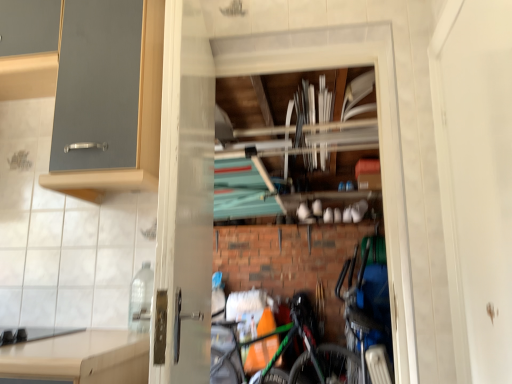
What do you see at coordinates (284, 352) in the screenshot? I see `green matte bicycle at center, positioned as the 1th bicycle in front-to-back order` at bounding box center [284, 352].

What is the approximate width of clear plastic bottle at lower left?

4.80 inches.

Image resolution: width=512 pixels, height=384 pixels. Identify the location of matte gray cabinet at upper left. (138, 125).

The width and height of the screenshot is (512, 384). Identify the location of transparent glass screen door at center, the second screen door from the right. (184, 201).

Consider the image. Considering the relative sizes of green matte bicycle at center, acting as the second bicycle starting from the right, and black matte gas stove at lower left in the image provided, is green matte bicycle at center, acting as the second bicycle starting from the right, thinner than black matte gas stove at lower left?

Yes, green matte bicycle at center, acting as the second bicycle starting from the right, is thinner than black matte gas stove at lower left.

Is black matte gas stove at lower left inside green matte bicycle at center, which is the second bicycle from back to front?

No, black matte gas stove at lower left is not surrounded by green matte bicycle at center, which is the second bicycle from back to front.

Visually, is green matte bicycle at center, positioned as the 1th bicycle in front-to-back order, positioned to the left or to the right of black matte gas stove at lower left?

From the image, it's evident that green matte bicycle at center, positioned as the 1th bicycle in front-to-back order, is to the right of black matte gas stove at lower left.

Considering the sizes of green matte bicycle at center, which is the first bicycle from left to right, and black matte gas stove at lower left in the image, is green matte bicycle at center, which is the first bicycle from left to right, taller or shorter than black matte gas stove at lower left?

Clearly, green matte bicycle at center, which is the first bicycle from left to right, is taller compared to black matte gas stove at lower left.

From the image's perspective, would you say clear plastic bottle at lower left is positioned over white matte screen door at right, which ranks as the second screen door in left-to-right order?

No, from the image's perspective, clear plastic bottle at lower left is not on top of white matte screen door at right, which ranks as the second screen door in left-to-right order.

Is clear plastic bottle at lower left to the right of white matte screen door at right, which ranks as the second screen door in left-to-right order, from the viewer's perspective?

No.

Considering the relative sizes of clear plastic bottle at lower left and white matte screen door at right, which ranks as the second screen door in left-to-right order, in the image provided, is clear plastic bottle at lower left shorter than white matte screen door at right, which ranks as the second screen door in left-to-right order,?

Yes, clear plastic bottle at lower left is shorter than white matte screen door at right, which ranks as the second screen door in left-to-right order.

Where is `bottle that appears behind the white matte screen door at right, the 1th screen door positioned from the right`? bottle that appears behind the white matte screen door at right, the 1th screen door positioned from the right is located at coordinates (141, 299).

Which is further, (486, 312) or (313, 379)?

The point (313, 379) is farther from the camera.

From the image's perspective, is white matte screen door at right, which ranks as the second screen door in left-to-right order, positioned above or below green matte bicycle at center, which is the second bicycle from back to front?

From the image's perspective, white matte screen door at right, which ranks as the second screen door in left-to-right order, appears above green matte bicycle at center, which is the second bicycle from back to front.

Could green matte bicycle at center, which is the first bicycle from left to right, be considered to be inside white matte screen door at right, the 1th screen door positioned from the right?

No, white matte screen door at right, the 1th screen door positioned from the right, does not contain green matte bicycle at center, which is the first bicycle from left to right.

Is white matte screen door at right, the 1th screen door positioned from the right, aimed at green matte bicycle at center, acting as the second bicycle starting from the right?

No, white matte screen door at right, the 1th screen door positioned from the right, is not aimed at green matte bicycle at center, acting as the second bicycle starting from the right.

Is there a large distance between green matte bicycle at center, which is the first bicycle from left to right, and matte gray cabinet at upper left?

green matte bicycle at center, which is the first bicycle from left to right, is positioned a significant distance from matte gray cabinet at upper left.

Is green matte bicycle at center, positioned as the 1th bicycle in front-to-back order, turned away from matte gray cabinet at upper left?

No, green matte bicycle at center, positioned as the 1th bicycle in front-to-back order, is not facing the opposite direction of matte gray cabinet at upper left.

Is the surface of transparent glass screen door at center, which is counted as the first screen door, starting from the left, in direct contact with white matte screen door at right, which ranks as the second screen door in left-to-right order?

They are not placed beside each other.

Where is `screen door on the left of white matte screen door at right, which ranks as the second screen door in left-to-right order`? screen door on the left of white matte screen door at right, which ranks as the second screen door in left-to-right order is located at coordinates (184, 201).

Which object is more forward, transparent glass screen door at center, which is counted as the first screen door, starting from the left, or white matte screen door at right, the 1th screen door positioned from the right?

Positioned in front is white matte screen door at right, the 1th screen door positioned from the right.

Which of these two, transparent glass screen door at center, the second screen door from the right, or white matte screen door at right, which ranks as the second screen door in left-to-right order, is thinner?

white matte screen door at right, which ranks as the second screen door in left-to-right order, is thinner.

Is green matte bicycle at center, which is the first bicycle from left to right, completely or partially inside matte gray cabinet at upper left?

No, green matte bicycle at center, which is the first bicycle from left to right, is located outside of matte gray cabinet at upper left.

Considering the relative sizes of matte gray cabinet at upper left and green matte bicycle at center, acting as the second bicycle starting from the right, in the image provided, is matte gray cabinet at upper left bigger than green matte bicycle at center, acting as the second bicycle starting from the right,?

Yes.

Which object is closer to the camera, matte gray cabinet at upper left or green matte bicycle at center, which is the first bicycle from left to right?

matte gray cabinet at upper left is in front.

Is matte gray cabinet at upper left to the left of green matte bicycle at center, positioned as the 1th bicycle in front-to-back order, from the viewer's perspective?

Yes.

The width and height of the screenshot is (512, 384). In order to click on the 1st bicycle to the right of the black matte gas stove at lower left, starting your count from the anchor in this screenshot , I will do `click(284, 352)`.

Is black matte gas stove at lower left positioned behind green matte bicycle at center, which is the first bicycle from left to right?

No, black matte gas stove at lower left is closer to the camera.

Who is shorter, black matte gas stove at lower left or green matte bicycle at center, which is the second bicycle from back to front?

With less height is black matte gas stove at lower left.

How many degrees apart are the facing directions of black matte gas stove at lower left and green matte bicycle at center, which is the first bicycle from left to right?

The angular difference between black matte gas stove at lower left and green matte bicycle at center, which is the first bicycle from left to right, is 1.08e-05 degrees.

Identify the location of gas stove in front of the green matte bicycle at center, which is the first bicycle from left to right. (32, 334).

The image size is (512, 384). Identify the location of bottle that is behind the white matte screen door at right, which ranks as the second screen door in left-to-right order. (141, 299).

Considering their positions, is green matte bicycle at center, which is the first bicycle from left to right, positioned further to blue metallic bicycle at lower right, placed as the 1th bicycle when sorted from right to left, than matte gray cabinet at upper left?

matte gray cabinet at upper left lies further to blue metallic bicycle at lower right, placed as the 1th bicycle when sorted from right to left, than the other object.

Looking at the image, which one is located closer to matte gray cabinet at upper left, blue metallic bicycle at lower right, placed as the 1th bicycle when sorted from right to left, or clear plastic bottle at lower left?

Among the two, clear plastic bottle at lower left is located nearer to matte gray cabinet at upper left.

Considering their positions, is black matte gas stove at lower left positioned further to matte gray cabinet at upper left than green matte bicycle at center, acting as the second bicycle starting from the right?

green matte bicycle at center, acting as the second bicycle starting from the right, is positioned further to the anchor matte gray cabinet at upper left.

Looking at the image, which one is located closer to matte gray cabinet at upper left, green matte bicycle at center, positioned as the 1th bicycle in front-to-back order, or white matte screen door at right, the 1th screen door positioned from the right?

The object closer to matte gray cabinet at upper left is white matte screen door at right, the 1th screen door positioned from the right.

Which object lies further to the anchor point white matte screen door at right, the 1th screen door positioned from the right, clear plastic bottle at lower left or black matte gas stove at lower left?

black matte gas stove at lower left.

Estimate the real-world distances between objects in this image. Which object is closer to clear plastic bottle at lower left, white matte screen door at right, the 1th screen door positioned from the right, or black matte gas stove at lower left?

Based on the image, black matte gas stove at lower left appears to be nearer to clear plastic bottle at lower left.

Based on their spatial positions, is matte gray cabinet at upper left or transparent glass screen door at center, which is counted as the first screen door, starting from the left, further from green matte bicycle at center, acting as the second bicycle starting from the right?

matte gray cabinet at upper left is positioned further to the anchor green matte bicycle at center, acting as the second bicycle starting from the right.

Based on their spatial positions, is matte gray cabinet at upper left or blue metallic bicycle at lower right, the 1th bicycle in the back-to-front sequence, closer to black matte gas stove at lower left?

matte gray cabinet at upper left is closer to black matte gas stove at lower left.

Image resolution: width=512 pixels, height=384 pixels. I want to click on gas stove between matte gray cabinet at upper left and green matte bicycle at center, acting as the second bicycle starting from the right, from top to bottom, so (x=32, y=334).

The width and height of the screenshot is (512, 384). What are the coordinates of `cabinetry between black matte gas stove at lower left and white matte screen door at right, which ranks as the second screen door in left-to-right order` in the screenshot? It's located at (138, 125).

Locate an element on the screen. The image size is (512, 384). bicycle between matte gray cabinet at upper left and blue metallic bicycle at lower right, placed as the 1th bicycle when sorted from right to left, from left to right is located at coordinates (284, 352).

Identify the location of bicycle between white matte screen door at right, the 1th screen door positioned from the right, and blue metallic bicycle at lower right, the 1th bicycle in the back-to-front sequence, along the z-axis. (284, 352).